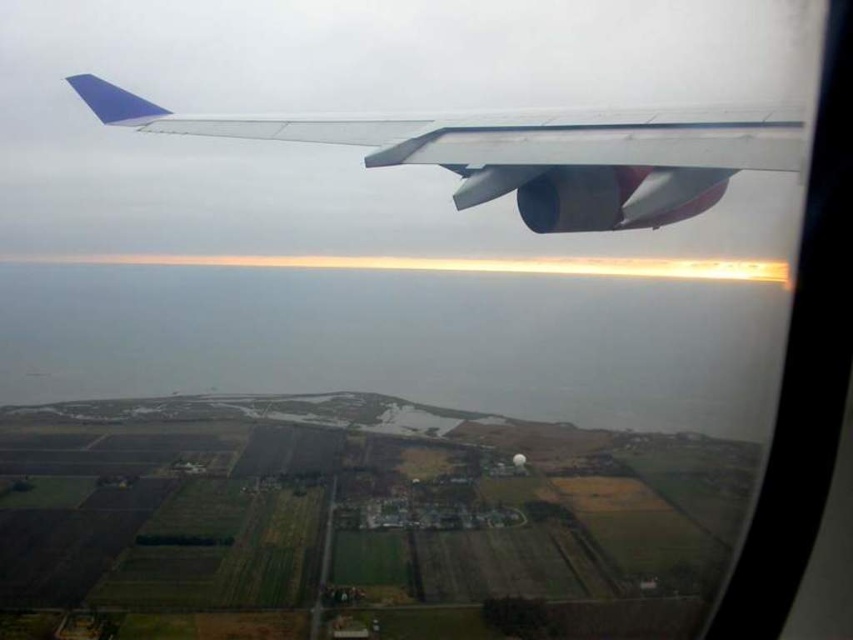
You are a pilot checking the view from the cockpit. You notice the green grassy fields at lower center and the metallic silver wing at upper center. Which of these two objects appears taller in the image?

The green grassy fields at lower center appears taller than the metallic silver wing at upper center according to the description.

You are a pilot flying at an altitude of 610 meters. You look out the window and see the green grassy fields at lower center. Can you determine if you are exactly at the altitude mentioned?

The green grassy fields at lower center and viewer are 610.31 meters apart, so yes, the pilot is exactly at the mentioned altitude of 610 meters.